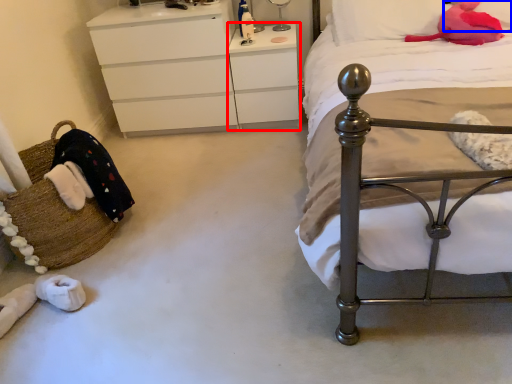
Question: Which object appears closest to the camera in this image, changing table (highlighted by a red box) or pillow (highlighted by a blue box)?

Choices:
 (A) changing table
 (B) pillow

Answer: (B)